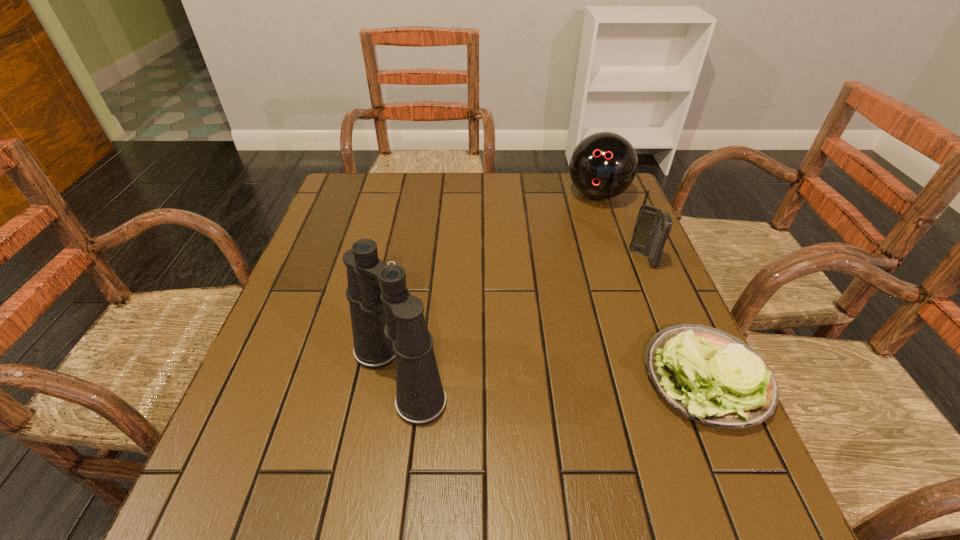
This screenshot has height=540, width=960. Identify the location of object that is at the near right corner. (712, 377).

The height and width of the screenshot is (540, 960). In the image, there is a desktop. What are the coordinates of `blank space at the far edge` in the screenshot? It's located at (535, 173).

In the image, there is a desktop. Identify the location of vacant space at the near edge. This screenshot has height=540, width=960. click(603, 434).

Locate an element on the screen. This screenshot has width=960, height=540. free space at the left edge is located at coordinates (329, 275).

In the image, there is a desktop. Where is `vacant space at the right edge`? The height and width of the screenshot is (540, 960). vacant space at the right edge is located at coordinates (646, 297).

This screenshot has width=960, height=540. In the image, there is a desktop. What are the coordinates of `free space at the far left corner` in the screenshot? It's located at (358, 207).

Where is `vacant space at the far right corner of the desktop`? This screenshot has height=540, width=960. vacant space at the far right corner of the desktop is located at coordinates (626, 190).

The image size is (960, 540). I want to click on vacant space that is in between the third nearest object and the shortest object, so click(675, 318).

Image resolution: width=960 pixels, height=540 pixels. I want to click on vacant area between the farthest object and the shortest object, so click(652, 286).

Find the location of a particular element. The height and width of the screenshot is (540, 960). free point between the bowling ball and the shortest object is located at coordinates (652, 286).